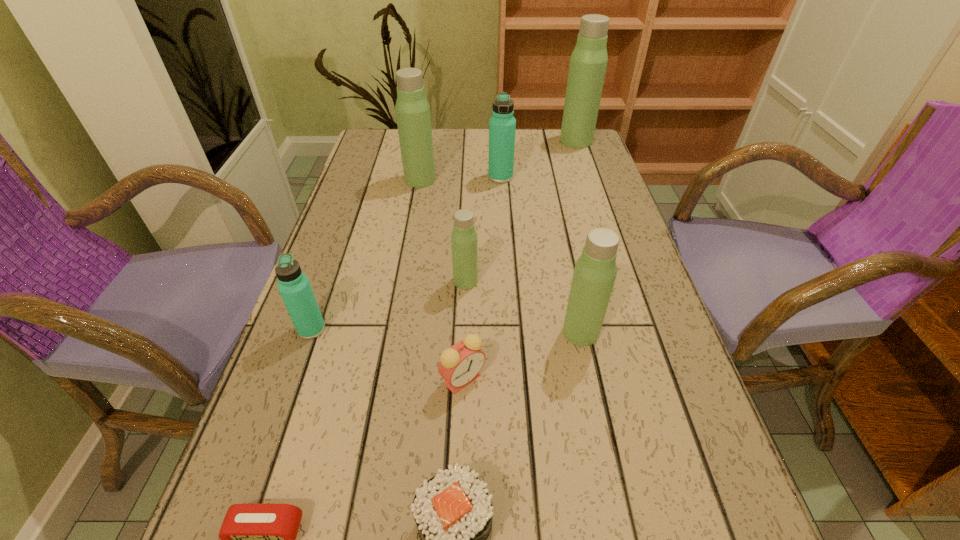
Choose which object is the fourth nearest neighbor to the sushi. Please provide its 2D coordinates. Your answer should be formatted as a tuple, i.e. [(x, y)], where the tuple contains the x and y coordinates of a point satisfying the conditions above.

[(295, 289)]

Identify the location of thermos bottle that is the nearest to the seventh object from left to right. The height and width of the screenshot is (540, 960). (412, 108).

Where is `thermos bottle that is the second closest to the third biggest light thermos bottle`? thermos bottle that is the second closest to the third biggest light thermos bottle is located at coordinates (295, 289).

I want to click on light thermos bottle that stands as the second closest to the farther pink alarm clock, so (x=464, y=236).

Find the location of a particular element. the closest light thermos bottle to the farthest object is located at coordinates (412, 108).